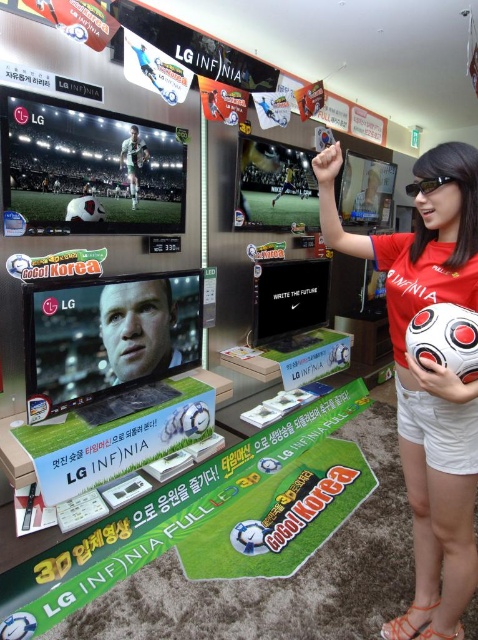
Does matte red shirt at center have a lesser width compared to shiny plastic soccer ball at upper left?

Correct, matte red shirt at center's width is less than shiny plastic soccer ball at upper left's.

Does matte red shirt at center have a larger size compared to shiny plastic soccer ball at upper left?

Indeed, matte red shirt at center has a larger size compared to shiny plastic soccer ball at upper left.

Is point (354, 246) in front of point (123, 189)?

Yes, it is in front of point (123, 189).

At what (x,y) coordinates should I click in order to perform the action: click on matte red shirt at center. Please return your answer as a coordinate pair (x, y). Image resolution: width=478 pixels, height=640 pixels. Looking at the image, I should click on (427, 376).